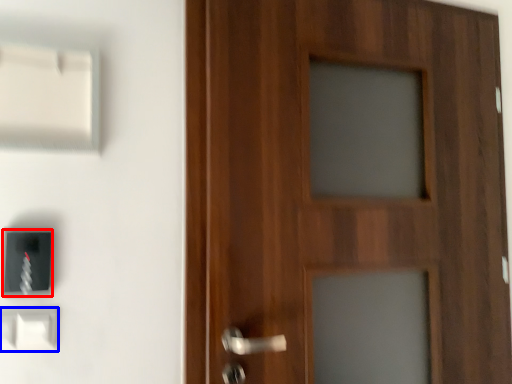
Question: Among these objects, which one is farthest to the camera, light switch (highlighted by a red box) or light switch (highlighted by a blue box)?

Choices:
 (A) light switch
 (B) light switch

Answer: (A)